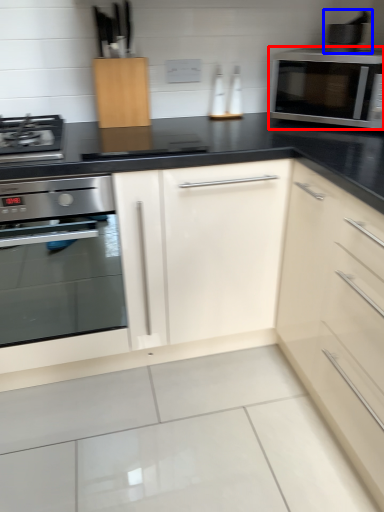
Question: Which of the following is the farthest to the observer, microwave oven (highlighted by a red box) or appliance (highlighted by a blue box)?

Choices:
 (A) microwave oven
 (B) appliance

Answer: (B)